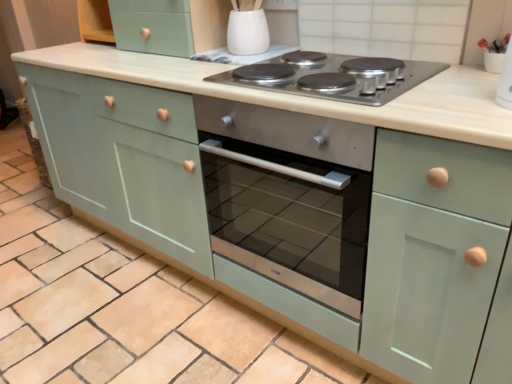
Where is `free space in front of white glossy vase at upper center`? free space in front of white glossy vase at upper center is located at coordinates pos(242,66).